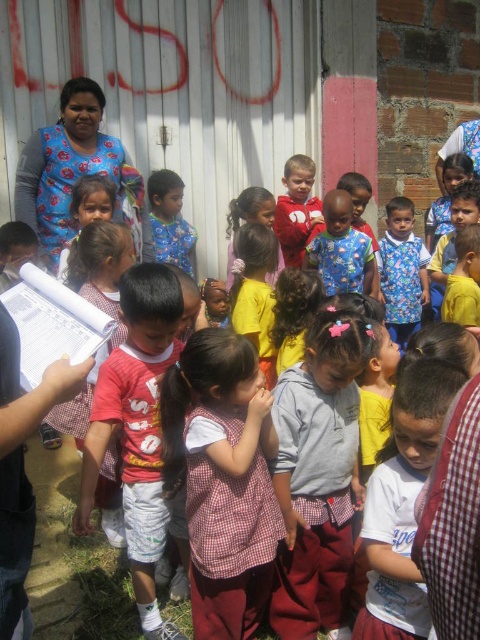
Question: Which of the following is the closest to the observer?

Choices:
 (A) (143, 506)
 (B) (242, 358)

Answer: (B)

Question: Does checkered fabric dress at center have a larger size compared to red cotton shirt at center?

Choices:
 (A) no
 (B) yes

Answer: (A)

Question: Considering the relative positions of checkered fabric dress at center and red cotton shirt at center in the image provided, where is checkered fabric dress at center located with respect to red cotton shirt at center?

Choices:
 (A) above
 (B) below

Answer: (B)

Question: Is checkered fabric dress at center wider than red cotton shirt at center?

Choices:
 (A) yes
 (B) no

Answer: (A)

Question: Which point is closer to the camera?

Choices:
 (A) checkered fabric dress at center
 (B) red cotton shirt at center

Answer: (A)